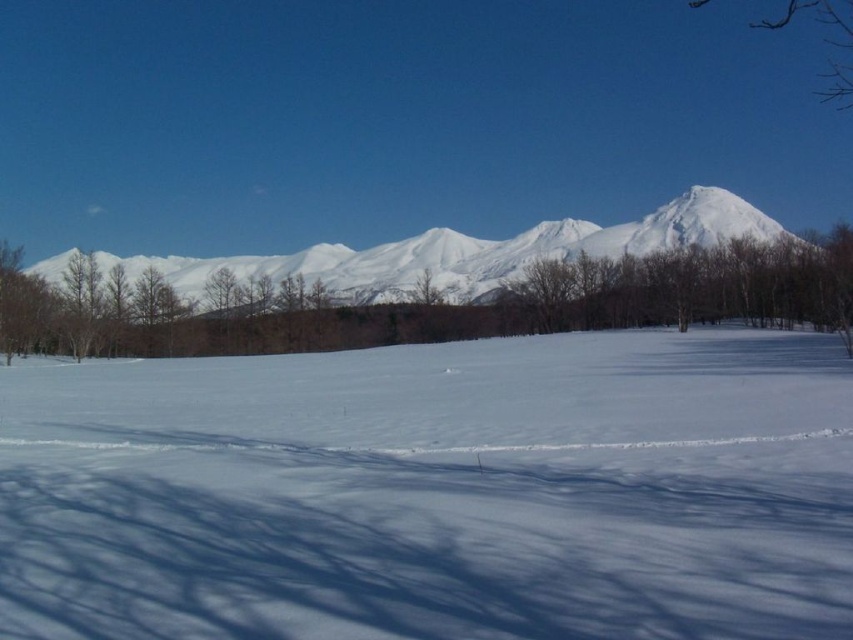
Question: Does white snow at center come in front of white snow-covered mountain at center?

Choices:
 (A) no
 (B) yes

Answer: (B)

Question: Does white snow at center lie behind white snow-covered mountain at center?

Choices:
 (A) yes
 (B) no

Answer: (B)

Question: In this image, where is white snow at center located relative to white snow-covered mountain at center?

Choices:
 (A) left
 (B) right

Answer: (B)